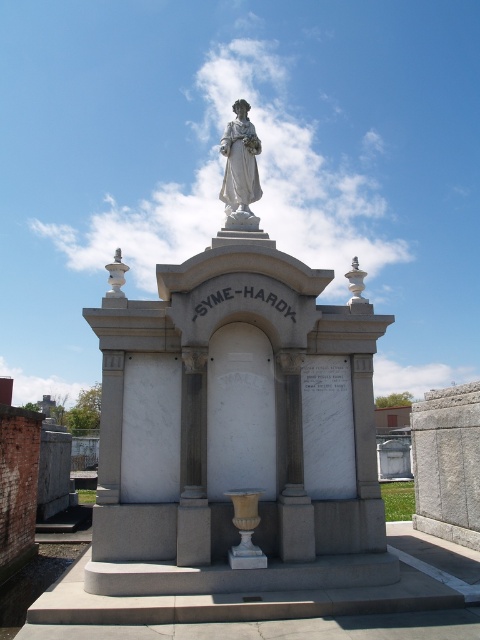
You are an architect visiting the Syme Hardy mausoleum and want to take a photo of both the white marble statue at center and the white marble statue at upper center. Which statue should you focus on first to ensure both are in frame?

You should focus on the white marble statue at center first because it is larger in size than the white marble statue at upper center, so capturing it first ensures both will fit in the frame.

What is located at the point with coordinates (237,419) in the image?

A white marble statue at center is located at the point with coordinates (237,419).